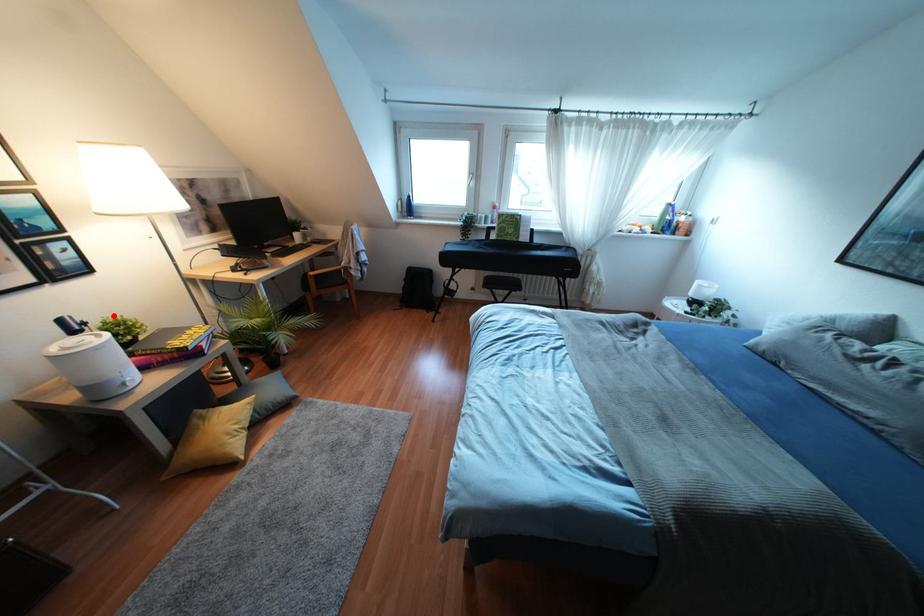
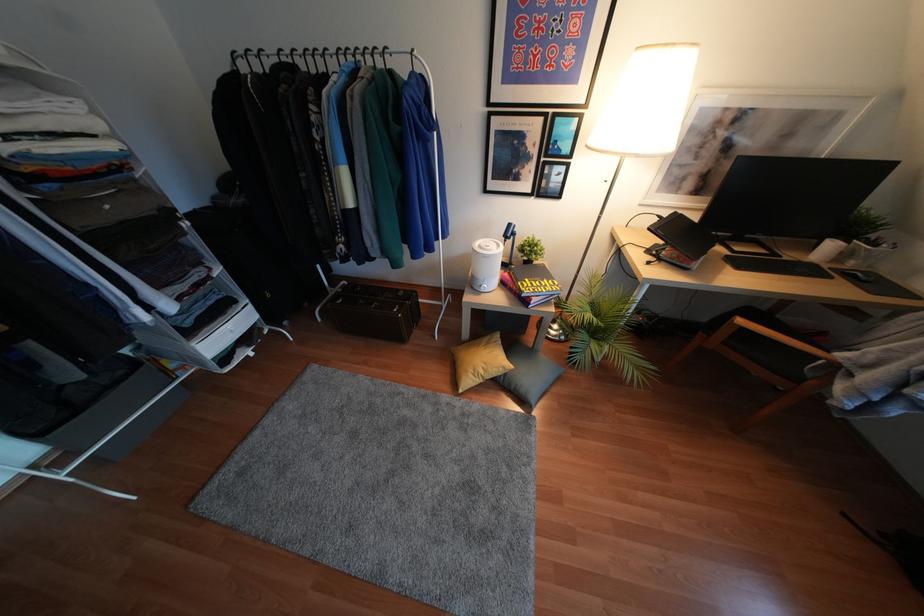
Question: I am providing you with two images of the same scene from different viewpoints. A red point is shown in image1. For the corresponding object point in image2, is it positioned nearer or farther from the camera?

Choices:
 (A) Nearer
 (B) Farther

Answer: (A)